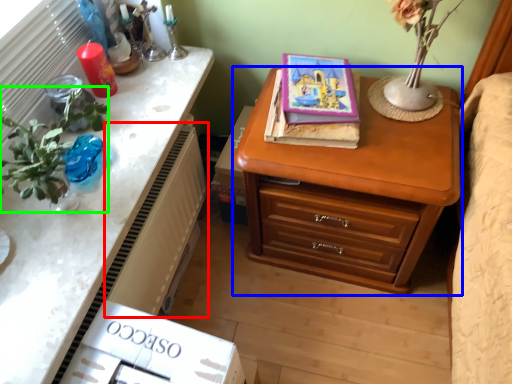
Question: Which is nearer to the radiator (highlighted by a red box)? chest of drawers (highlighted by a blue box) or floral arrangement (highlighted by a green box).

Choices:
 (A) chest of drawers
 (B) floral arrangement

Answer: (B)